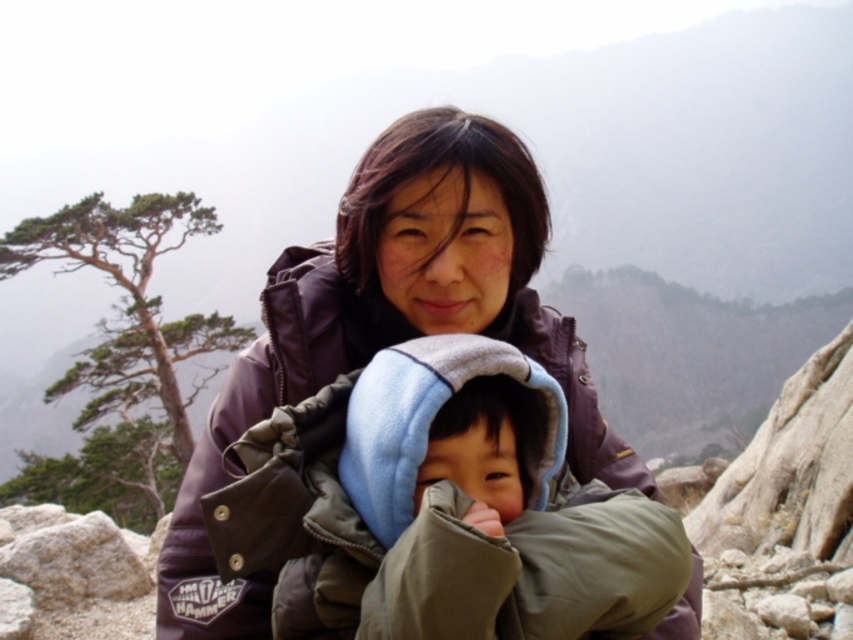
Can you confirm if light gray fleece jacket at center is positioned to the right of matte purple jacket at center?

Indeed, light gray fleece jacket at center is positioned on the right side of matte purple jacket at center.

Find the location of a particular element. This screenshot has width=853, height=640. light gray fleece jacket at center is located at coordinates tap(505, 525).

The image size is (853, 640). I want to click on light gray fleece jacket at center, so click(x=505, y=525).

Image resolution: width=853 pixels, height=640 pixels. Find the location of `light gray fleece jacket at center`. light gray fleece jacket at center is located at coordinates (505, 525).